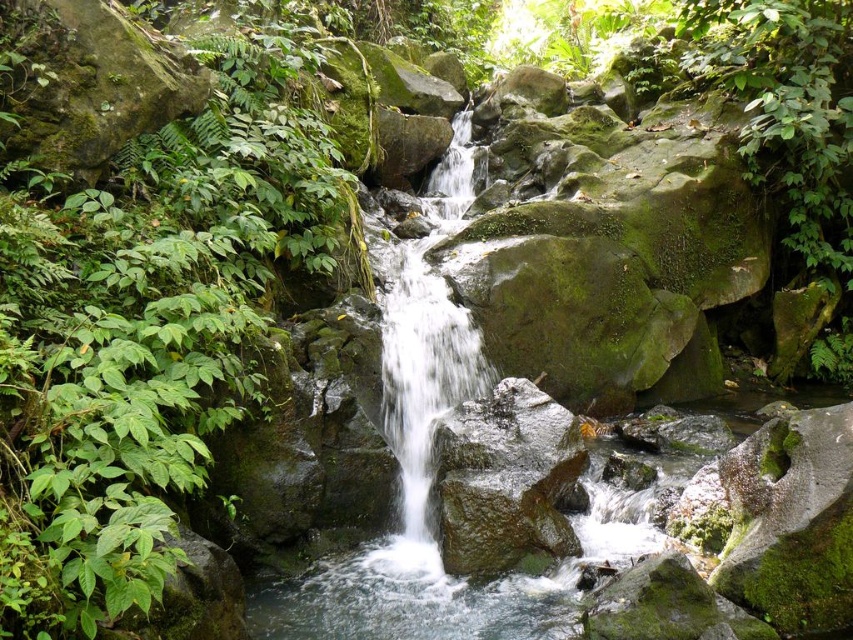
You are planning to place a small statue between the green leafy plant at left and the smooth gray rock at center. Based on their sizes, which object should you position closer to the statue to ensure it doesn

The green leafy plant at left has a larger width than the smooth gray rock at center. To ensure the statue is placed appropriately, position it closer to the smaller object, which is the smooth gray rock at center, so there is enough space around the statue.

You are standing at the edge of the waterfall and want to reach the smooth gray rock at center. There is a green leafy plant at left blocking your path. Can you walk around it to the right to get to the rock?

The green leafy plant at left is to the left of the smooth gray rock at center, so you can walk around to the right side of the plant to reach the rock without obstruction.